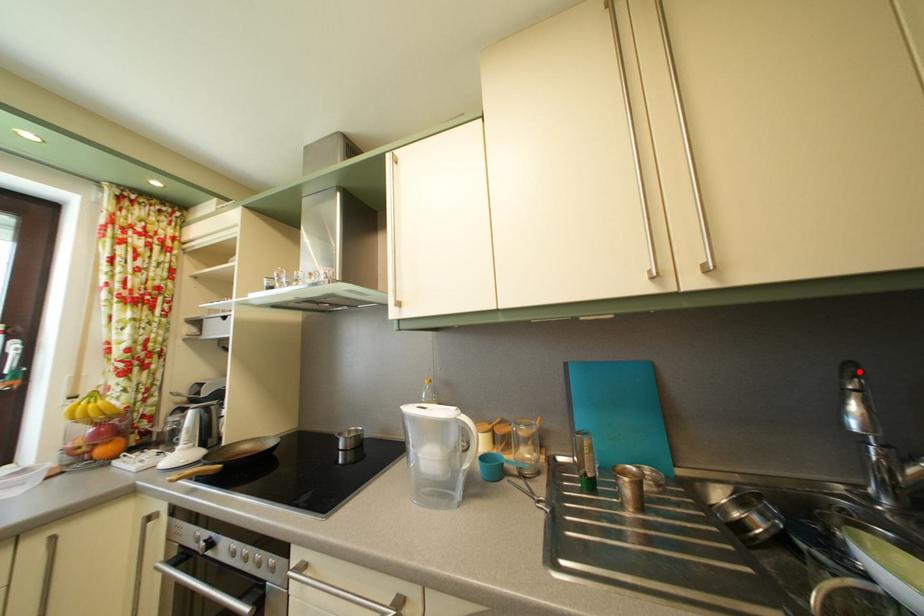
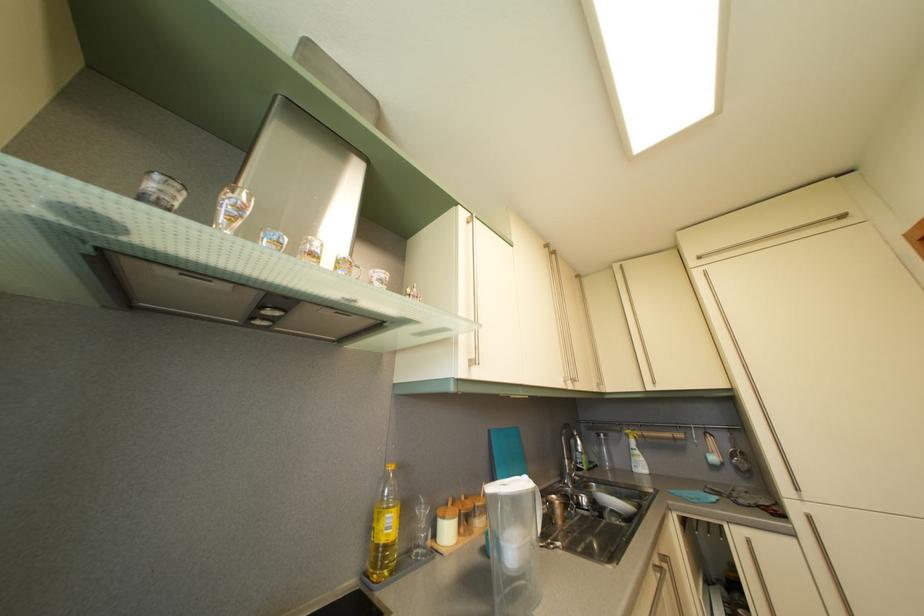
Locate, in the second image, the point that corresponds to the highlighted location in the first image.

(575, 432)